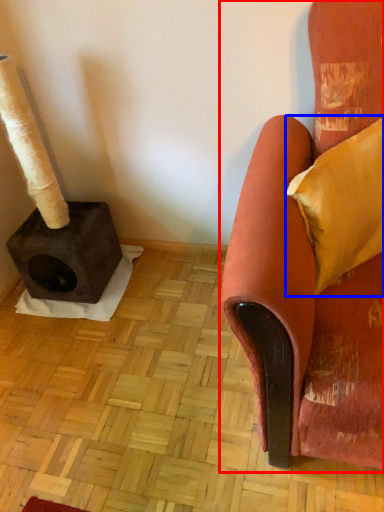
Question: Which object appears farthest to the camera in this image, chair (highlighted by a red box) or pillow (highlighted by a blue box)?

Choices:
 (A) chair
 (B) pillow

Answer: (B)